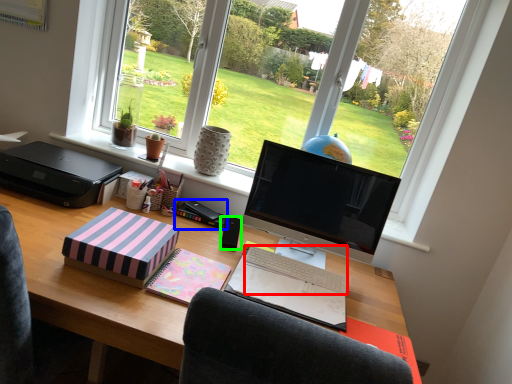
Question: Based on their relative distances, which object is nearer to computer keyboard (highlighted by a red box)? Choose from book (highlighted by a blue box) and speaker (highlighted by a green box).

Choices:
 (A) book
 (B) speaker

Answer: (B)